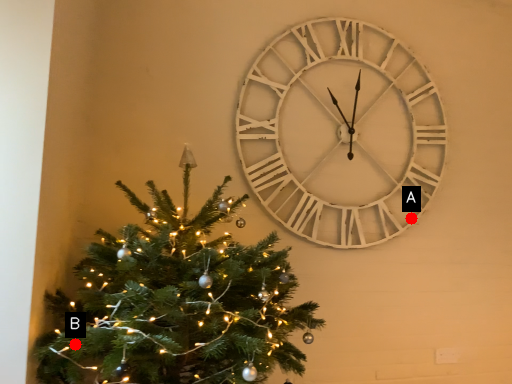
Question: Two points are circled on the image, labeled by A and B beside each circle. Which of the following is the farthest from the observer?

Choices:
 (A) A is further
 (B) B is further

Answer: (A)